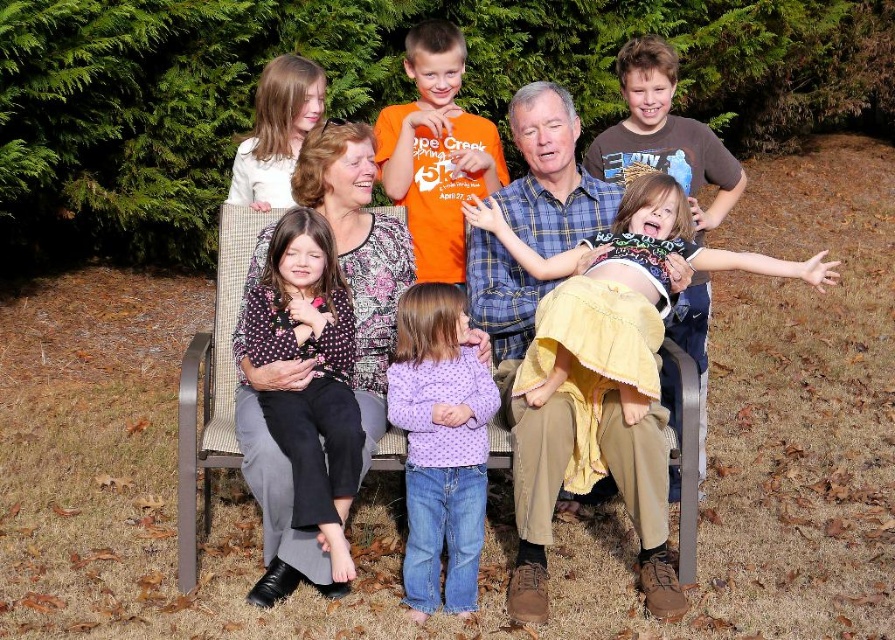
Can you confirm if matte yellow dress at center is shorter than orange cotton shirt at center?

Incorrect, matte yellow dress at center's height does not fall short of orange cotton shirt at center's.

Who is positioned more to the right, matte yellow dress at center or orange cotton shirt at center?

From the viewer's perspective, orange cotton shirt at center appears more on the right side.

Between point (672, 65) and point (415, 205), which one is positioned in front?

Point (672, 65)

Where is `matte yellow dress at center`? The height and width of the screenshot is (640, 895). matte yellow dress at center is located at coordinates (551, 204).

Can you confirm if polka dot blouse at center is positioned to the right of orange cotton shirt at center?

Incorrect, polka dot blouse at center is not on the right side of orange cotton shirt at center.

Which is more to the right, polka dot blouse at center or orange cotton shirt at center?

From the viewer's perspective, orange cotton shirt at center appears more on the right side.

Does point (297, 257) come behind point (415, 212)?

That is False.

Find the location of a particular element. polka dot blouse at center is located at coordinates (312, 378).

Who is higher up, polka dot blouse at center or yellow lace dress at right?

yellow lace dress at right is higher up.

Locate an element on the screen. The image size is (895, 640). polka dot blouse at center is located at coordinates (312, 378).

Image resolution: width=895 pixels, height=640 pixels. I want to click on polka dot blouse at center, so click(312, 378).